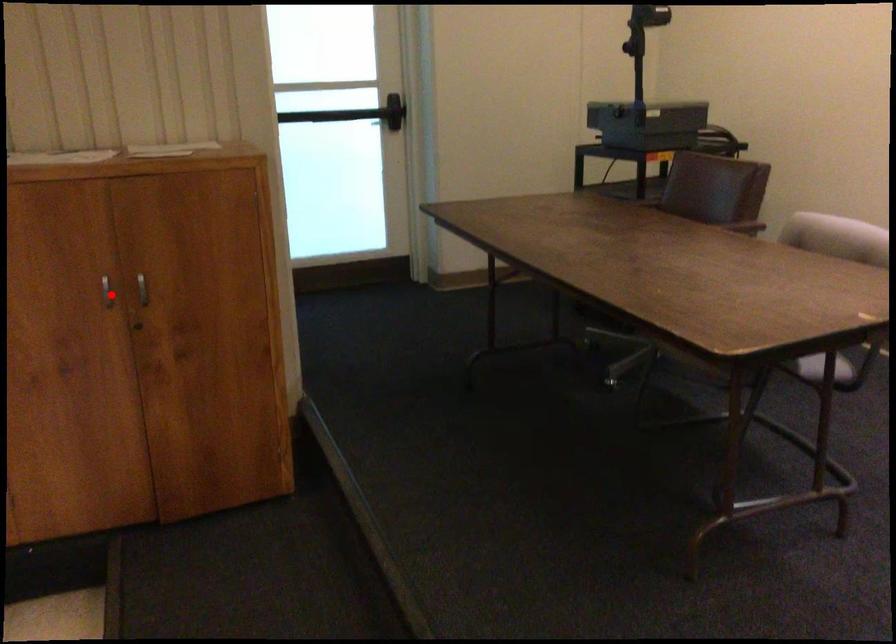
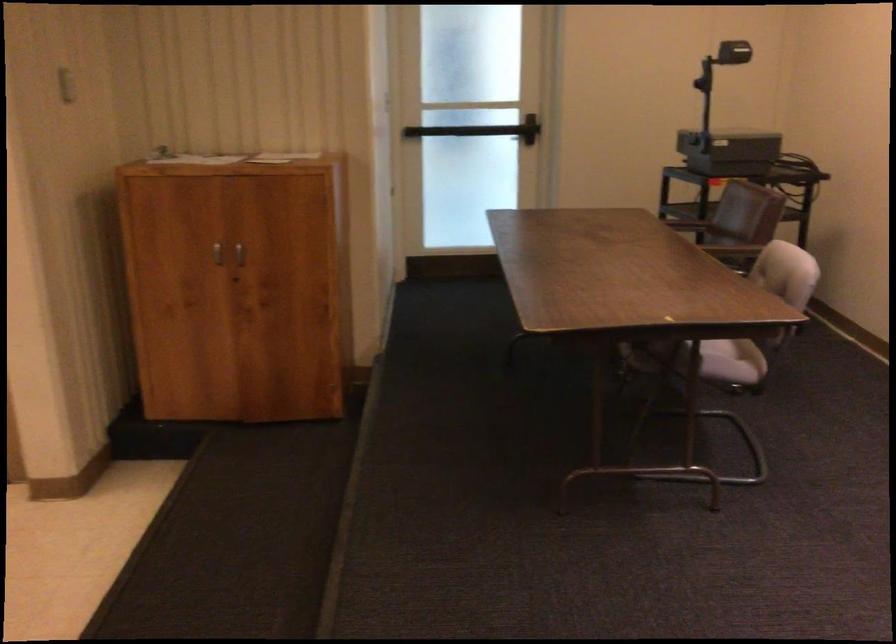
Question: I am providing you with two images of the same scene from different viewpoints. Image1 has a red point marked. In image2, the corresponding 3D location appears at what relative position? Reply with the corresponding letter.

Choices:
 (A) Closer
 (B) Farther

Answer: (B)